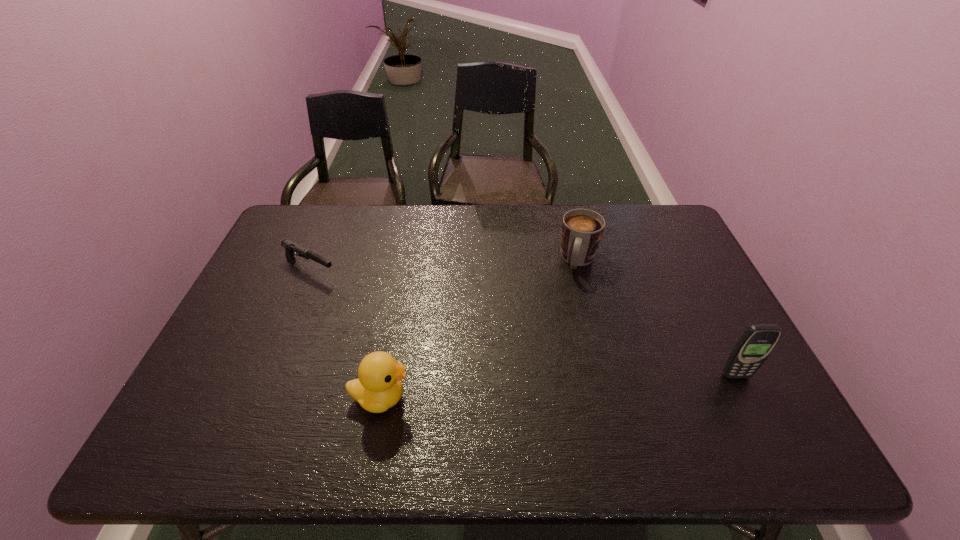
Find the location of a particular element. vacant space situated on the side of the mug with the handle is located at coordinates (550, 380).

At what (x,y) coordinates should I click in order to perform the action: click on free spot located 0.130m at the muzzle end of the gun. Please return your answer as a coordinate pair (x, y). Looking at the image, I should click on (365, 294).

Identify the location of vacant space located at the muzzle end of the gun. (436, 331).

I want to click on vacant space located 0.250m at the muzzle end of the gun, so click(396, 310).

This screenshot has height=540, width=960. Identify the location of object that is at the far edge. (582, 229).

Locate an element on the screen. This screenshot has height=540, width=960. object that is positioned at the near edge is located at coordinates (379, 387).

You are a GUI agent. You are given a task and a screenshot of the screen. Output one action in this format:
    pyautogui.click(x=<x>, y=<y>)
    Task: Click on the object present at the left edge
    This screenshot has height=540, width=960.
    Given the screenshot: What is the action you would take?
    pyautogui.click(x=290, y=247)

You are a GUI agent. You are given a task and a screenshot of the screen. Output one action in this format:
    pyautogui.click(x=<x>, y=<y>)
    Task: Click on the object located in the right edge section of the desktop
    
    Given the screenshot: What is the action you would take?
    pyautogui.click(x=755, y=345)

I want to click on free location at the far edge, so click(556, 232).

You are a GUI agent. You are given a task and a screenshot of the screen. Output one action in this format:
    pyautogui.click(x=<x>, y=<y>)
    Task: Click on the free region at the left edge
    
    Given the screenshot: What is the action you would take?
    pyautogui.click(x=268, y=253)